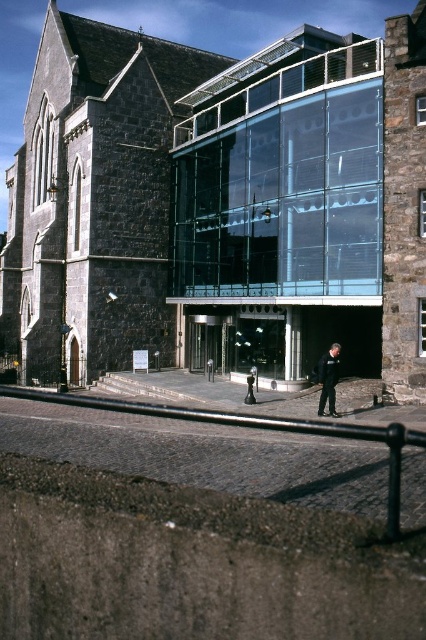
Is dark stone church at center bigger than black leather jacket at lower center?

Yes.

Is point (83, 234) positioned behind point (321, 364)?

Yes, point (83, 234) is behind point (321, 364).

Where is `dark stone church at center`? Image resolution: width=426 pixels, height=640 pixels. dark stone church at center is located at coordinates (219, 204).